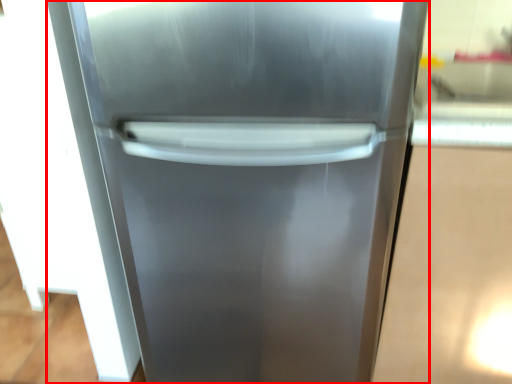
Question: From the image's perspective, considering the relative positions of refrigerator (annotated by the red box) and glass door in the image provided, where is refrigerator (annotated by the red box) located with respect to the staircase?

Choices:
 (A) below
 (B) above

Answer: (A)